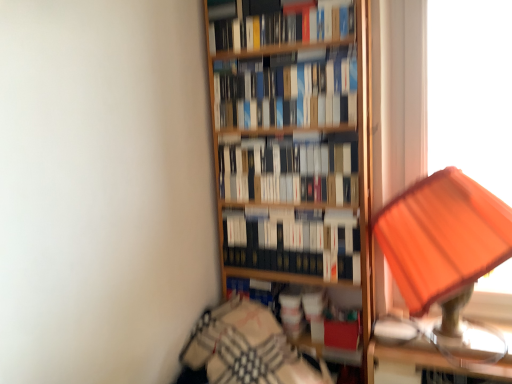
Where is `free point above hardcover books at center, which is counted as the 3th book, starting from the bottom (from a real-world perspective)`? The width and height of the screenshot is (512, 384). free point above hardcover books at center, which is counted as the 3th book, starting from the bottom (from a real-world perspective) is located at coordinates (280, 52).